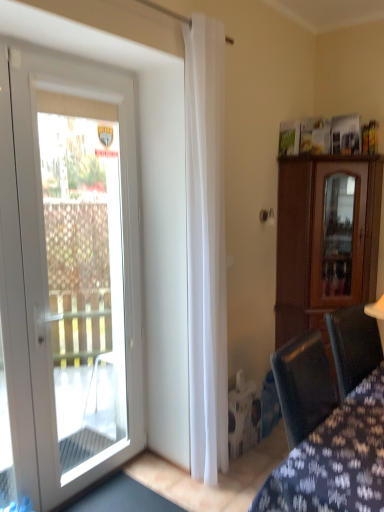
Describe the element at coordinates (335, 460) in the screenshot. Image resolution: width=384 pixels, height=512 pixels. I see `velvet dark blue chair at lower right` at that location.

This screenshot has width=384, height=512. I want to click on white glass door at left, so click(x=70, y=271).

Measure the distance between point (285, 243) and camera.

A distance of 3.20 meters exists between point (285, 243) and camera.

The image size is (384, 512). What do you see at coordinates (206, 247) in the screenshot?
I see `white sheer curtain at center` at bounding box center [206, 247].

Find the location of a particular element. The width and height of the screenshot is (384, 512). velvet dark blue chair at lower right is located at coordinates (335, 460).

Is white sheer curtain at center taller or shorter than velvet dark blue chair at lower right?

Clearly, white sheer curtain at center is taller compared to velvet dark blue chair at lower right.

Which object is further away from the camera, white sheer curtain at center or velvet dark blue chair at lower right?

white sheer curtain at center.

Is white sheer curtain at center oriented towards velvet dark blue chair at lower right?

No, white sheer curtain at center is not oriented towards velvet dark blue chair at lower right.

From a real-world perspective, is brown wooden cabinet at right below white glass door at left?

Yes, from a real-world perspective, brown wooden cabinet at right is below white glass door at left.

Considering the positions of objects brown wooden cabinet at right and white glass door at left in the image provided, who is in front, brown wooden cabinet at right or white glass door at left?

white glass door at left.

Are brown wooden cabinet at right and white glass door at left beside each other?

brown wooden cabinet at right is not next to white glass door at left, and they're not touching.

Does point (317, 164) come behind point (84, 155)?

No, (317, 164) is in front of (84, 155).

Image resolution: width=384 pixels, height=512 pixels. I want to click on curtain that is on the left side of velvet dark blue chair at lower right, so click(206, 247).

From a real-world perspective, is velvet dark blue chair at lower right positioned under white sheer curtain at center based on gravity?

Yes, from a real-world perspective, velvet dark blue chair at lower right is beneath white sheer curtain at center.

Consider the image. How many degrees apart are the facing directions of velvet dark blue chair at lower right and white sheer curtain at center?

They differ by 0.841 degrees in their facing directions.

In the image, is velvet dark blue chair at lower right positioned in front of or behind white sheer curtain at center?

velvet dark blue chair at lower right is positioned closer to the viewer than white sheer curtain at center.

Consider the image. Measure the distance from white glass door at left to white sheer curtain at center.

They are 22.80 inches apart.

Looking at this image, are white glass door at left and white sheer curtain at center far apart?

Actually, white glass door at left and white sheer curtain at center are a little close together.

Based on the photo, how many degrees apart are the facing directions of white glass door at left and white sheer curtain at center?

The facing directions of white glass door at left and white sheer curtain at center are 93 degrees apart.

Is point (70, 182) positioned before point (199, 350)?

No.

Is brown wooden cabinet at right positioned beyond the bounds of velvet dark blue chair at lower right?

That's correct, brown wooden cabinet at right is outside of velvet dark blue chair at lower right.

Is brown wooden cabinet at right closer to camera compared to velvet dark blue chair at lower right?

No, brown wooden cabinet at right is behind velvet dark blue chair at lower right.

From a real-world perspective, is brown wooden cabinet at right under velvet dark blue chair at lower right?

No, from a real-world perspective, brown wooden cabinet at right is not under velvet dark blue chair at lower right.

Can you confirm if brown wooden cabinet at right is smaller than velvet dark blue chair at lower right?

No, brown wooden cabinet at right is not smaller than velvet dark blue chair at lower right.

Is white glass door at left aimed at velvet dark blue chair at lower right?

No, white glass door at left is not oriented towards velvet dark blue chair at lower right.

How different are the orientations of white glass door at left and velvet dark blue chair at lower right in degrees?

There is a 92.1-degree angle between the facing directions of white glass door at left and velvet dark blue chair at lower right.

Where is `door above the velvet dark blue chair at lower right (from a real-world perspective)`? door above the velvet dark blue chair at lower right (from a real-world perspective) is located at coordinates (70, 271).

Between point (11, 229) and point (364, 468), which one is positioned in front?

The point (364, 468) is in front.

Which is correct: brown wooden cabinet at right is inside white sheer curtain at center, or outside of it?

The correct answer is: outside.

Relative to white sheer curtain at center, is brown wooden cabinet at right in front or behind?

Visually, brown wooden cabinet at right is located behind white sheer curtain at center.

From a real-world perspective, is brown wooden cabinet at right below white sheer curtain at center?

Yes, from a real-world perspective, brown wooden cabinet at right is under white sheer curtain at center.

At what (x,y) coordinates should I click in order to perform the action: click on curtain on the left of the velvet dark blue chair at lower right. Please return your answer as a coordinate pair (x, y). The height and width of the screenshot is (512, 384). Looking at the image, I should click on (206, 247).

Locate an element on the screen. The image size is (384, 512). cabinetry that appears below the white glass door at left (from a real-world perspective) is located at coordinates (321, 239).

Which object lies further to the anchor point velvet dark blue chair at lower right, brown wooden cabinet at right or white sheer curtain at center?

brown wooden cabinet at right is further to velvet dark blue chair at lower right.

From the image, which object appears to be nearer to white sheer curtain at center, velvet dark blue chair at lower right or brown wooden cabinet at right?

velvet dark blue chair at lower right.

Looking at the image, which one is located closer to brown wooden cabinet at right, white sheer curtain at center or white glass door at left?

white sheer curtain at center.

Considering their positions, is brown wooden cabinet at right positioned further to white sheer curtain at center than white glass door at left?

brown wooden cabinet at right is further to white sheer curtain at center.

Which object lies further to the anchor point velvet dark blue chair at lower right, white glass door at left or brown wooden cabinet at right?

white glass door at left is further to velvet dark blue chair at lower right.

Based on their spatial positions, is white sheer curtain at center or brown wooden cabinet at right further from velvet dark blue chair at lower right?

brown wooden cabinet at right.

Based on their spatial positions, is brown wooden cabinet at right or velvet dark blue chair at lower right closer to white sheer curtain at center?

velvet dark blue chair at lower right is positioned closer to the anchor white sheer curtain at center.

Based on their spatial positions, is white glass door at left or white sheer curtain at center further from velvet dark blue chair at lower right?

Based on the image, white glass door at left appears to be further to velvet dark blue chair at lower right.

Identify the location of curtain between white glass door at left and velvet dark blue chair at lower right in the horizontal direction. (206, 247).

Locate an element on the screen. furniture situated between white glass door at left and brown wooden cabinet at right from left to right is located at coordinates (335, 460).

What are the coordinates of `curtain between velvet dark blue chair at lower right and brown wooden cabinet at right in the front-back direction` in the screenshot? It's located at pyautogui.click(x=206, y=247).

Find the location of a particular element. curtain situated between white glass door at left and brown wooden cabinet at right from left to right is located at coordinates (206, 247).